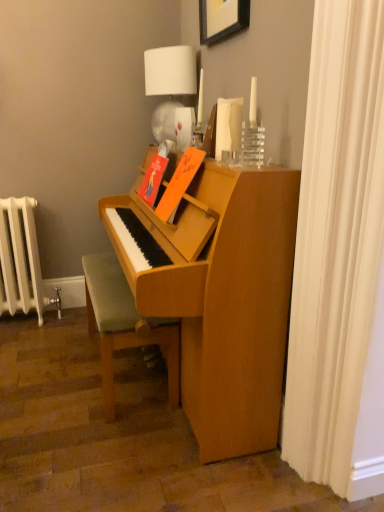
This screenshot has height=512, width=384. What do you see at coordinates (125, 325) in the screenshot? I see `light brown wooden bench at lower center` at bounding box center [125, 325].

Locate an element on the screen. wooden picture frame at upper center is located at coordinates (222, 19).

This screenshot has width=384, height=512. I want to click on white painted metal radiator at left, so click(x=21, y=261).

Measure the distance between point (6, 211) and camera.

8.16 feet.

The image size is (384, 512). Find the location of `white fabric shower curtain at right`. white fabric shower curtain at right is located at coordinates (337, 249).

Between white fabric lampshade at upper center and wooden picture frame at upper center, which one has smaller size?

Smaller between the two is wooden picture frame at upper center.

Considering the positions of point (175, 72) and point (245, 16), is point (175, 72) closer or farther from the camera than point (245, 16)?

Point (175, 72) appears to be farther away from the viewer than point (245, 16).

Is white fabric lampshade at upper center taller or shorter than wooden picture frame at upper center?

white fabric lampshade at upper center is taller than wooden picture frame at upper center.

Which of these two, white fabric lampshade at upper center or white painted metal radiator at left, is smaller?

With smaller size is white fabric lampshade at upper center.

From a real-world perspective, is white fabric lampshade at upper center physically located above or below white painted metal radiator at left?

Clearly, from a real-world perspective, white fabric lampshade at upper center is above white painted metal radiator at left.

Does white fabric lampshade at upper center have a greater height compared to white painted metal radiator at left?

Incorrect, the height of white fabric lampshade at upper center is not larger of that of white painted metal radiator at left.

In the scene shown: From the image's perspective, which object appears higher, white fabric lampshade at upper center or white painted metal radiator at left?

white fabric lampshade at upper center, from the image's perspective.

From the picture: Is light brown wooden bench at lower center positioned behind white fabric lampshade at upper center?

No, it is not.

In the scene shown: Based on their positions, is light brown wooden bench at lower center located to the left or right of white fabric lampshade at upper center?

light brown wooden bench at lower center is positioned on white fabric lampshade at upper center's left side.

Is light brown wooden bench at lower center bigger or smaller than white fabric lampshade at upper center?

In the image, light brown wooden bench at lower center appears to be larger than white fabric lampshade at upper center.

Considering the points (97, 254) and (184, 148), which point is behind, point (97, 254) or point (184, 148)?

The point (97, 254) is behind.

Between white fabric lampshade at upper center and light brown wooden bench at lower center, which one has less height?

light brown wooden bench at lower center is shorter.

Is white fabric lampshade at upper center smaller than light brown wooden bench at lower center?

Correct, white fabric lampshade at upper center occupies less space than light brown wooden bench at lower center.

In the image, is white fabric lampshade at upper center positioned in front of or behind light brown wooden bench at lower center?

Visually, white fabric lampshade at upper center is located behind light brown wooden bench at lower center.

Which is more distant, (166, 62) or (115, 292)?

Positioned behind is point (166, 62).

Where is `picture frame above the white fabric shower curtain at right (from a real-world perspective)`? Image resolution: width=384 pixels, height=512 pixels. picture frame above the white fabric shower curtain at right (from a real-world perspective) is located at coordinates (222, 19).

Is wooden picture frame at upper center wider than white fabric shower curtain at right?

Yes.

Is wooden picture frame at upper center far from white fabric shower curtain at right?

Indeed, wooden picture frame at upper center is not near white fabric shower curtain at right.

Consider the image. Is white painted metal radiator at left touching white fabric lampshade at upper center?

No, white painted metal radiator at left is not with white fabric lampshade at upper center.

Is point (30, 245) closer to viewer compared to point (162, 109)?

No, it is behind (162, 109).

Which object is further away from the camera taking this photo, white painted metal radiator at left or white fabric lampshade at upper center?

Positioned behind is white painted metal radiator at left.

From a real-world perspective, which object stands above the other?

white fabric shower curtain at right, from a real-world perspective.

What's the angular difference between light brown wooden bench at lower center and white fabric shower curtain at right's facing directions?

There is a 1.15-degree angle between the facing directions of light brown wooden bench at lower center and white fabric shower curtain at right.

Is white fabric shower curtain at right located within light brown wooden bench at lower center?

No, white fabric shower curtain at right is not inside light brown wooden bench at lower center.

Identify the location of picture frame that is above the white fabric lampshade at upper center (from a real-world perspective). (222, 19).

Where is `radiator beneath the white fabric lampshade at upper center (from a real-world perspective)`? This screenshot has width=384, height=512. radiator beneath the white fabric lampshade at upper center (from a real-world perspective) is located at coordinates (21, 261).

Considering their positions, is wooden picture frame at upper center positioned closer to white fabric lampshade at upper center than white fabric shower curtain at right?

wooden picture frame at upper center is positioned closer to the anchor white fabric lampshade at upper center.

Looking at the image, which one is located closer to white fabric shower curtain at right, white fabric lampshade at upper center or white painted metal radiator at left?

white fabric lampshade at upper center is positioned closer to the anchor white fabric shower curtain at right.

Estimate the real-world distances between objects in this image. Which object is further from white painted metal radiator at left, wooden picture frame at upper center or white fabric lampshade at upper center?

wooden picture frame at upper center is positioned further to the anchor white painted metal radiator at left.

Consider the image. Considering their positions, is white fabric lampshade at upper center positioned closer to light brown wooden bench at lower center than white fabric shower curtain at right?

white fabric shower curtain at right lies closer to light brown wooden bench at lower center than the other object.

Considering their positions, is white fabric shower curtain at right positioned further to light brown wooden bench at lower center than wooden picture frame at upper center?

wooden picture frame at upper center is positioned further to the anchor light brown wooden bench at lower center.

Based on their spatial positions, is white fabric lampshade at upper center or white fabric shower curtain at right closer to wooden picture frame at upper center?

white fabric lampshade at upper center is closer to wooden picture frame at upper center.

Looking at the image, which one is located closer to white painted metal radiator at left, white fabric lampshade at upper center or light brown wooden bench at lower center?

light brown wooden bench at lower center is positioned closer to the anchor white painted metal radiator at left.

Estimate the real-world distances between objects in this image. Which object is further from wooden picture frame at upper center, white fabric shower curtain at right or white painted metal radiator at left?

white painted metal radiator at left is further to wooden picture frame at upper center.

Find the location of a particular element. This screenshot has width=384, height=512. table lamp between wooden picture frame at upper center and light brown wooden bench at lower center in the vertical direction is located at coordinates (170, 71).

The width and height of the screenshot is (384, 512). Identify the location of radiator that lies between wooden picture frame at upper center and light brown wooden bench at lower center from top to bottom. (21, 261).

Find the location of a particular element. Image resolution: width=384 pixels, height=512 pixels. radiator between white fabric lampshade at upper center and light brown wooden bench at lower center in the up-down direction is located at coordinates (21, 261).

Identify the location of shower curtain between wooden picture frame at upper center and light brown wooden bench at lower center from top to bottom. The height and width of the screenshot is (512, 384). tap(337, 249).